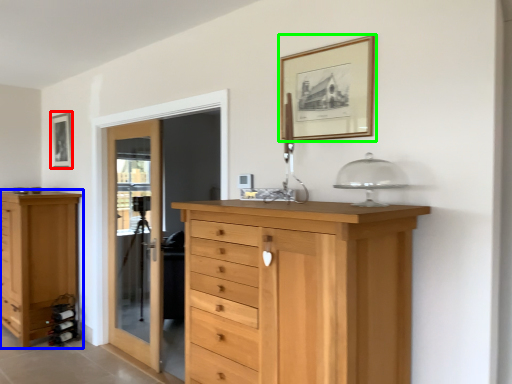
Question: Based on their relative distances, which object is nearer to picture frame (highlighted by a red box)? Choose from chest of drawers (highlighted by a blue box) and picture frame (highlighted by a green box).

Choices:
 (A) chest of drawers
 (B) picture frame

Answer: (A)